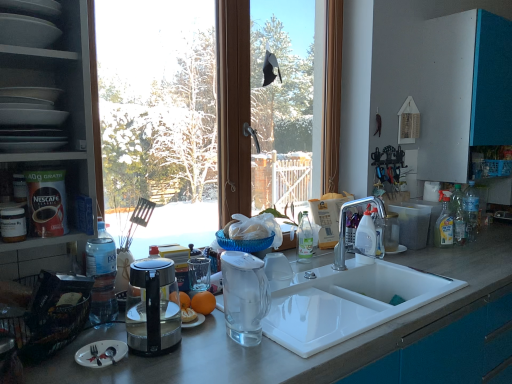
This screenshot has width=512, height=384. Find the location of `vacant area that lies between transparent glass blender at sink and silver metallic faucet at sink right`. vacant area that lies between transparent glass blender at sink and silver metallic faucet at sink right is located at coordinates (306, 306).